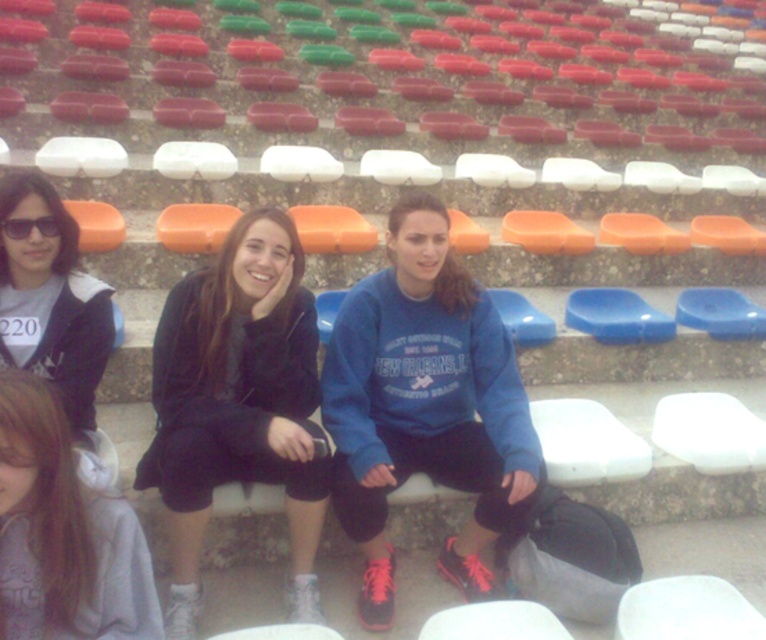
Question: Which of the following is the closest to the observer?

Choices:
 (A) (110, 307)
 (B) (273, 298)

Answer: (B)

Question: Which point is closer to the camera?

Choices:
 (A) (275, 282)
 (B) (5, 230)
 (C) (51, 189)
 (D) (388, 310)

Answer: (B)

Question: Can you confirm if gray fleece hoodie at lower left is bigger than matte black jacket at left?

Choices:
 (A) yes
 (B) no

Answer: (A)

Question: Can you confirm if matte black jacket at left is thinner than black plastic sunglasses at upper left?

Choices:
 (A) yes
 (B) no

Answer: (B)

Question: Which object is closer to the camera taking this photo?

Choices:
 (A) black matte jacket at center
 (B) gray fleece hoodie at lower left
 (C) black plastic sunglasses at upper left

Answer: (B)

Question: Can you confirm if gray fleece hoodie at lower left is smaller than black plastic sunglasses at upper left?

Choices:
 (A) yes
 (B) no

Answer: (B)